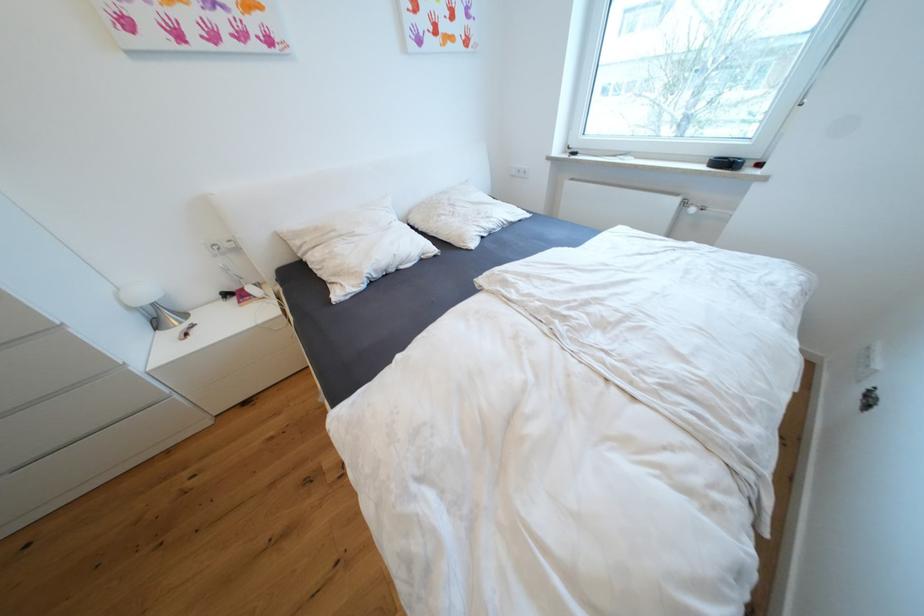
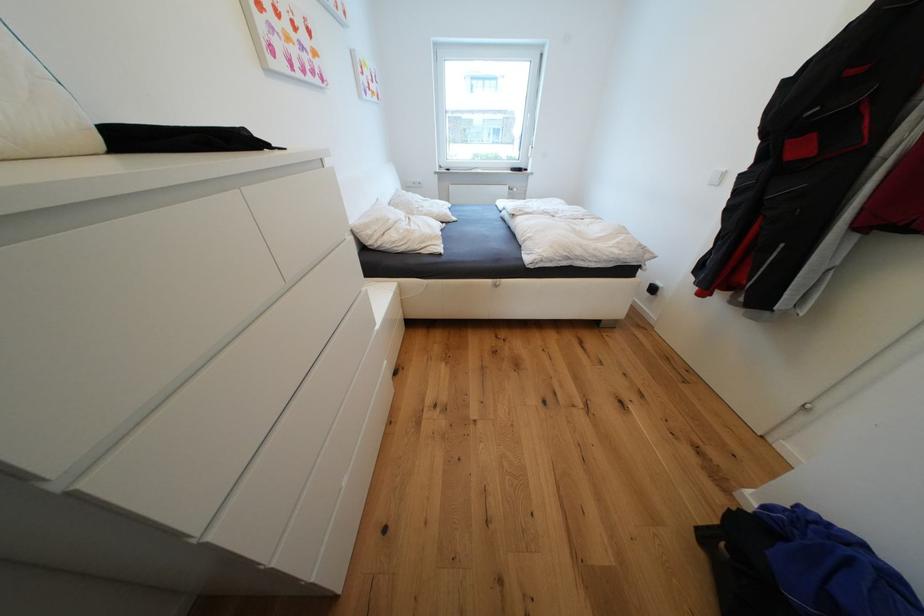
In the second image, find the point that corresponds to (x=684, y=201) in the first image.

(515, 188)